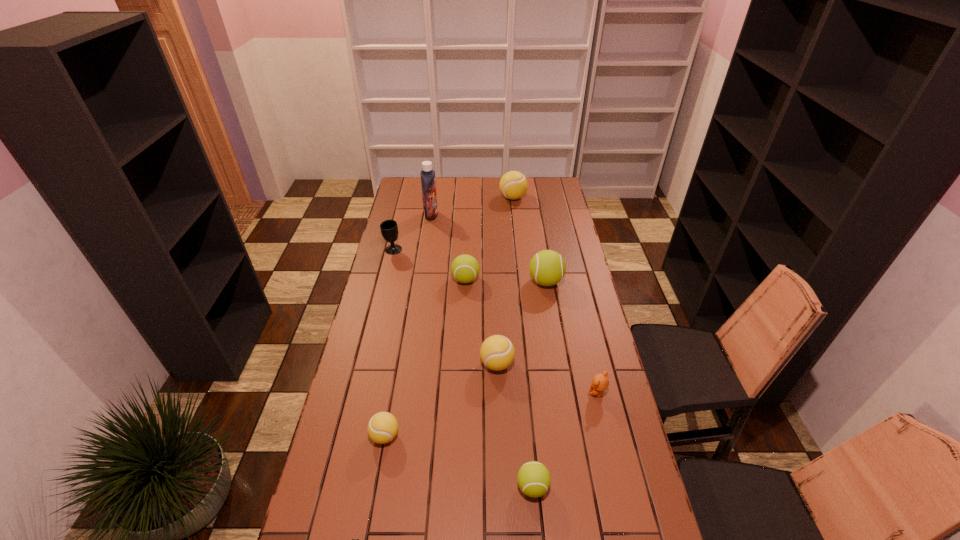
At what (x,y) coordinates should I click in order to perform the action: click on free location that satisfies the following two spatial constraints: 1. on the front label of the nearest tennis ball; 2. on the left side of the shampoo. Please return your answer as a coordinate pair (x, y). Looking at the image, I should click on pos(390,487).